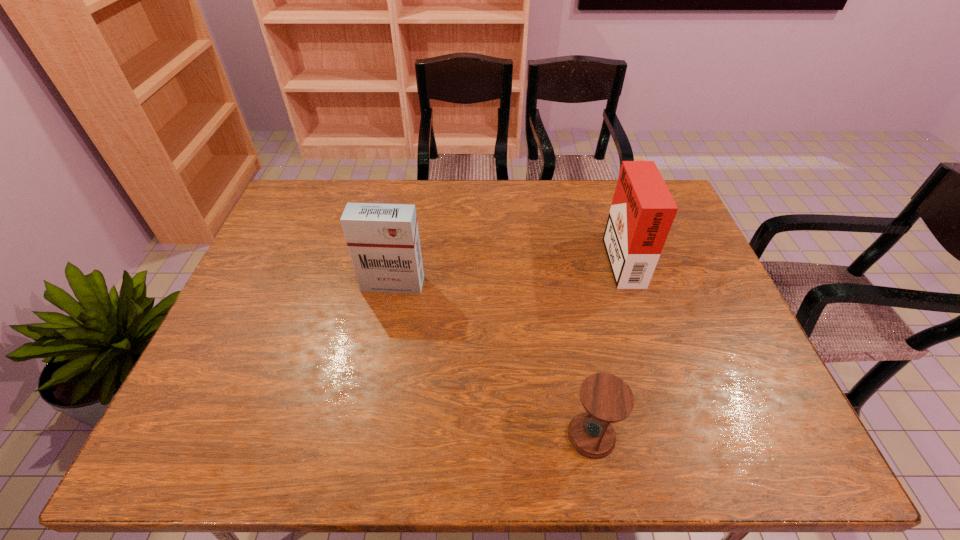
I want to click on the rightmost object, so click(x=642, y=211).

Where is `the leftmost object`? The image size is (960, 540). the leftmost object is located at coordinates (383, 240).

This screenshot has width=960, height=540. Identify the location of the nearest object. (607, 399).

In order to click on hourglass in this screenshot , I will do `click(607, 399)`.

The height and width of the screenshot is (540, 960). Find the location of `free spot located on the front-facing side of the rightmost object`. free spot located on the front-facing side of the rightmost object is located at coordinates (578, 256).

This screenshot has width=960, height=540. What are the coordinates of `vacant space located 0.050m on the front-facing side of the rightmost object` in the screenshot? It's located at (591, 256).

The image size is (960, 540). I want to click on vacant region located 0.380m on the front-facing side of the rightmost object, so click(x=483, y=256).

The height and width of the screenshot is (540, 960). What are the coordinates of `vacant space located on the front of the leftmost object` in the screenshot? It's located at (374, 379).

Find the location of a particular element. This screenshot has width=960, height=540. vacant space located 0.110m on the back of the hourglass is located at coordinates (580, 371).

Where is `object that is at the near edge`? object that is at the near edge is located at coordinates (607, 399).